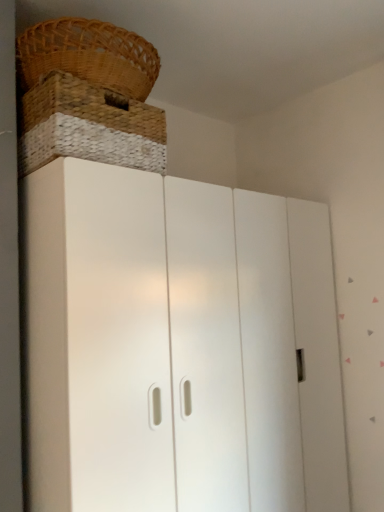
Question: In the image, is white matte cupboard at center on the left side or the right side of brown woven basket at upper left?

Choices:
 (A) right
 (B) left

Answer: (A)

Question: Does point (288, 465) appear closer or farther from the camera than point (46, 20)?

Choices:
 (A) farther
 (B) closer

Answer: (A)

Question: Is white matte cupboard at center taller or shorter than brown woven basket at upper left?

Choices:
 (A) tall
 (B) short

Answer: (A)

Question: Which is correct: brown woven basket at upper left is inside white matte cupboard at center, or outside of it?

Choices:
 (A) outside
 (B) inside

Answer: (A)

Question: Based on their sizes in the image, would you say brown woven basket at upper left is bigger or smaller than white matte cupboard at center?

Choices:
 (A) big
 (B) small

Answer: (B)

Question: From a real-world perspective, is brown woven basket at upper left physically located above or below white matte cupboard at center?

Choices:
 (A) above
 (B) below

Answer: (A)

Question: From the image's perspective, is brown woven basket at upper left located above or below white matte cupboard at center?

Choices:
 (A) below
 (B) above

Answer: (B)